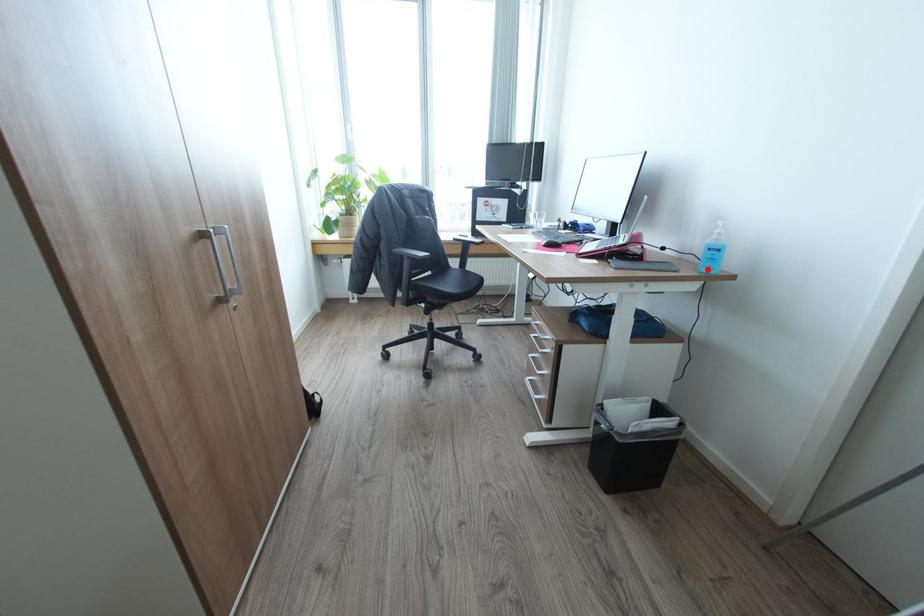
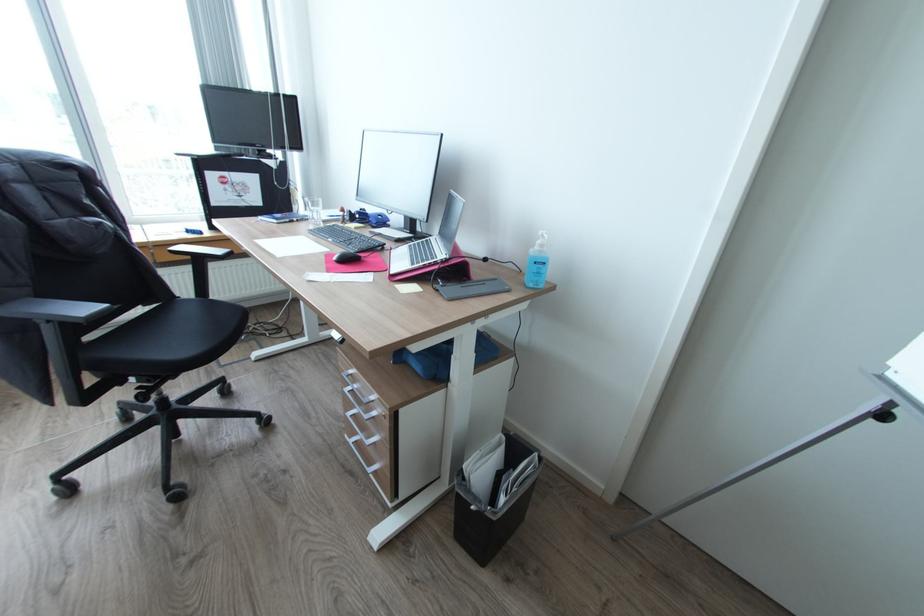
Find the pixel in the second image that matches the highlighted location in the first image.

(536, 284)